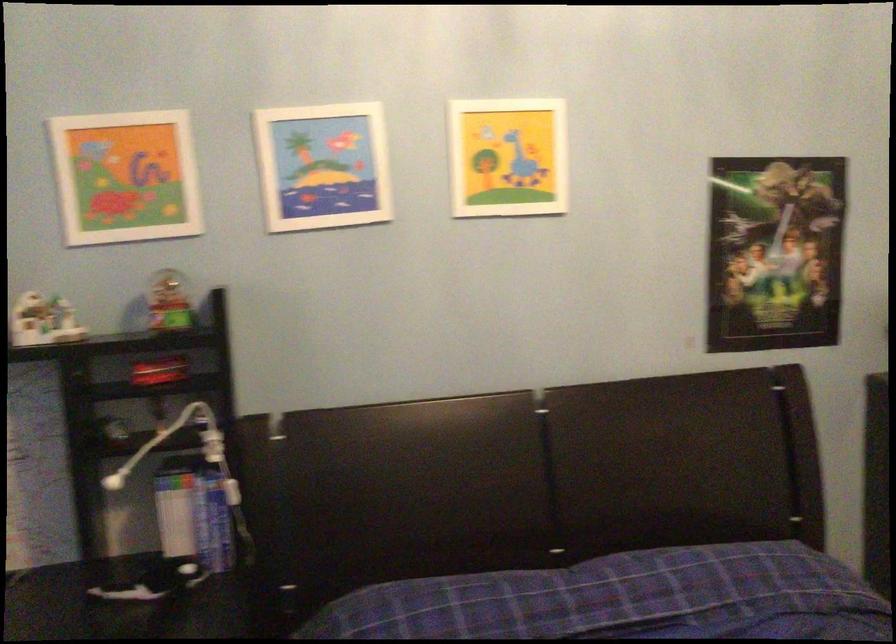
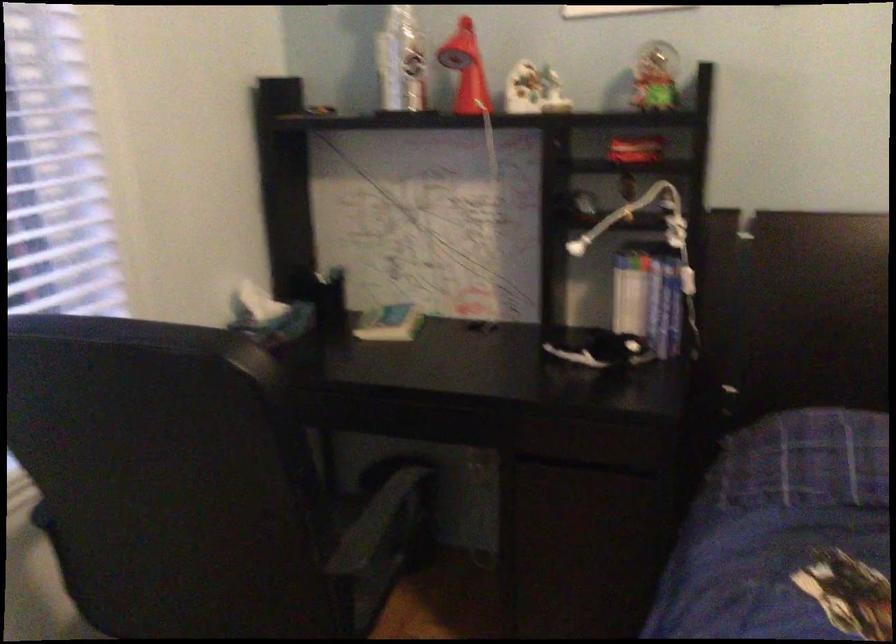
In the second image, find the point that corresponds to the point at 167,303 in the first image.

(655, 77)